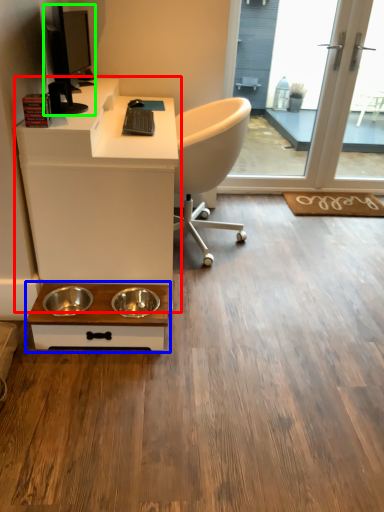
Question: Considering the real-world distances, which object is farthest from desk (highlighted by a red box)? table (highlighted by a blue box) or computer monitor (highlighted by a green box)?

Choices:
 (A) table
 (B) computer monitor

Answer: (B)